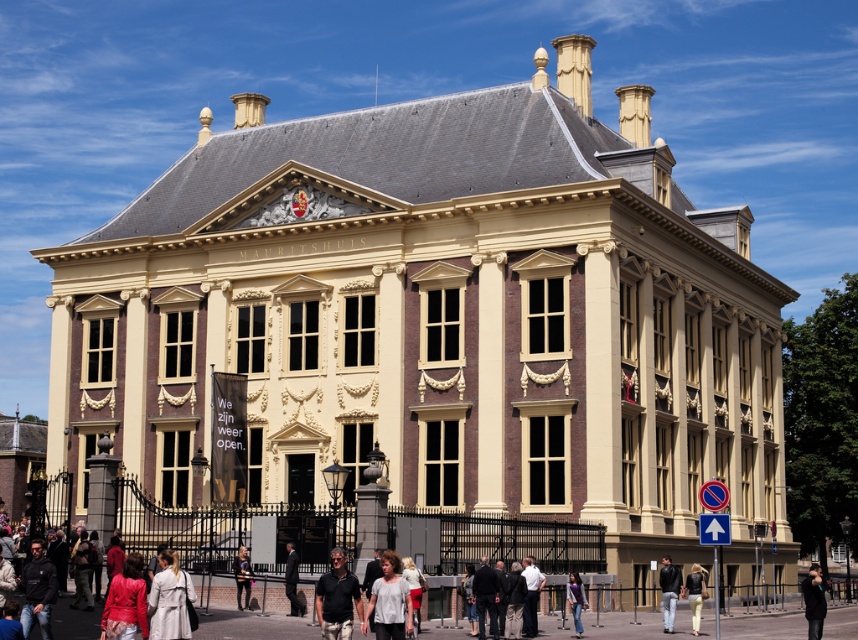
Question: Does light beige trench coat at lower left appear on the left side of leather jacket at lower right?

Choices:
 (A) yes
 (B) no

Answer: (A)

Question: Which point is closer to the camera?

Choices:
 (A) 669,602
 (B) 704,577
 (C) 246,605
 (D) 113,637

Answer: (D)

Question: Considering the real-world distances, which object is farthest from the leather jacket at lower right?

Choices:
 (A) denim jacket at lower center
 (B) matte black shirt at center
 (C) dark suit at center
 (D) light beige trench coat at lower left

Answer: (D)

Question: Can you confirm if matte black shirt at center is positioned to the right of dark blue jacket at lower right?

Choices:
 (A) yes
 (B) no

Answer: (B)

Question: Which point is closer to the camera?

Choices:
 (A) (802, 589)
 (B) (118, 595)

Answer: (B)

Question: Does light beige trench coat at lower left appear under matte red jacket at lower left?

Choices:
 (A) no
 (B) yes

Answer: (A)